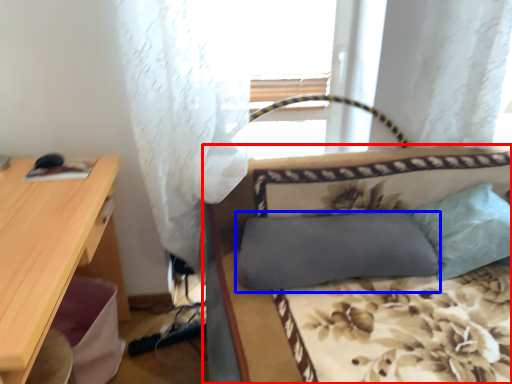
Question: Which of the following is the farthest to the observer, studio couch (highlighted by a red box) or pillow (highlighted by a blue box)?

Choices:
 (A) studio couch
 (B) pillow

Answer: (B)